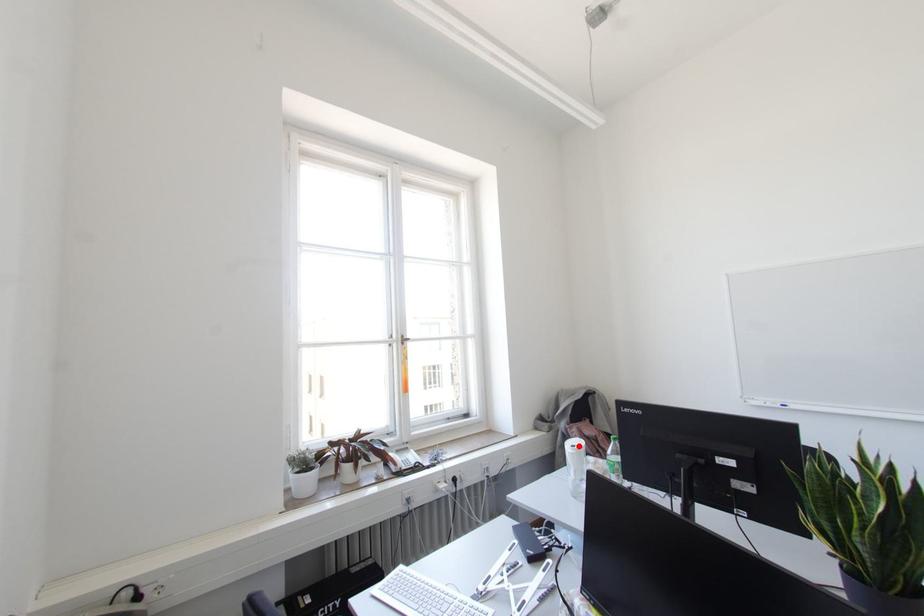
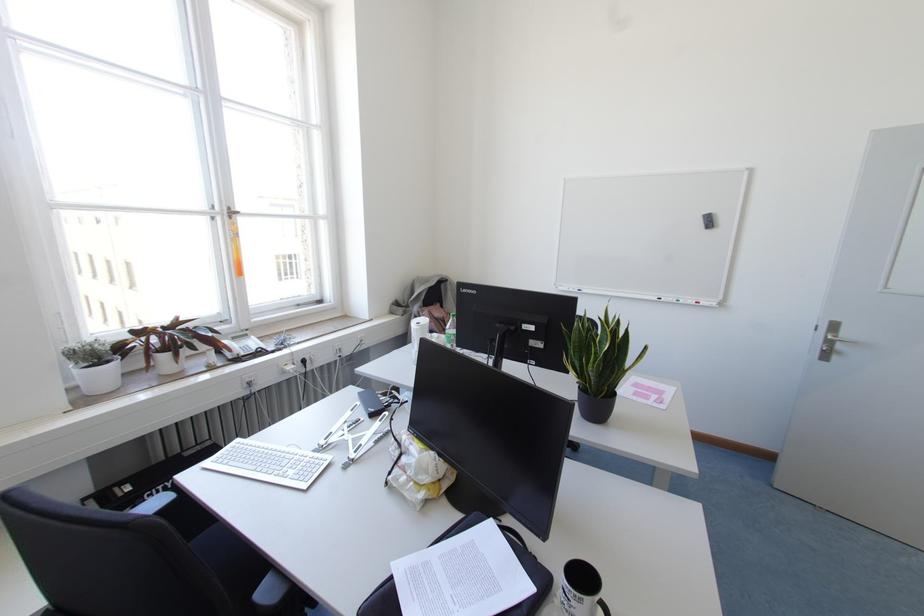
The point at the highlighted location is marked in the first image. Where is the corresponding point in the second image?

(423, 323)